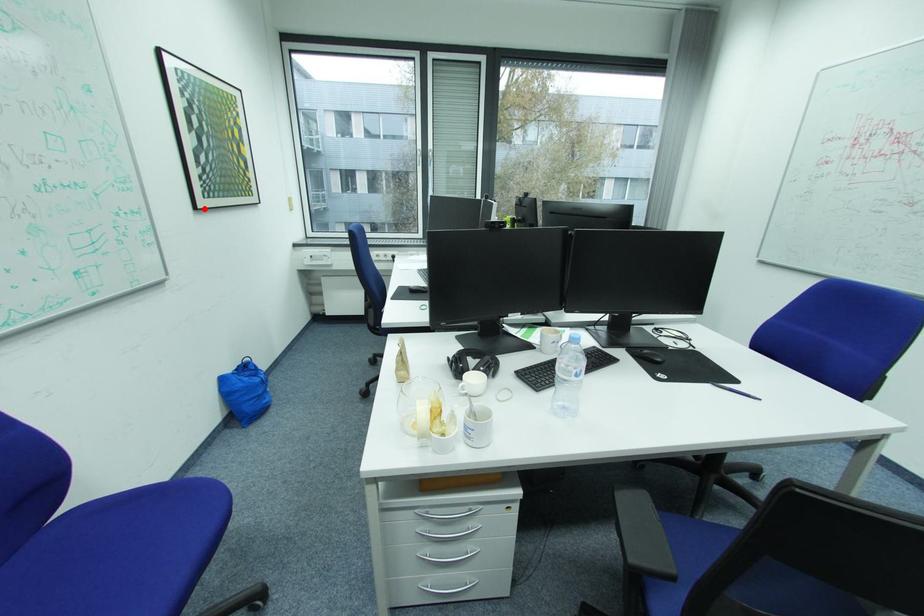
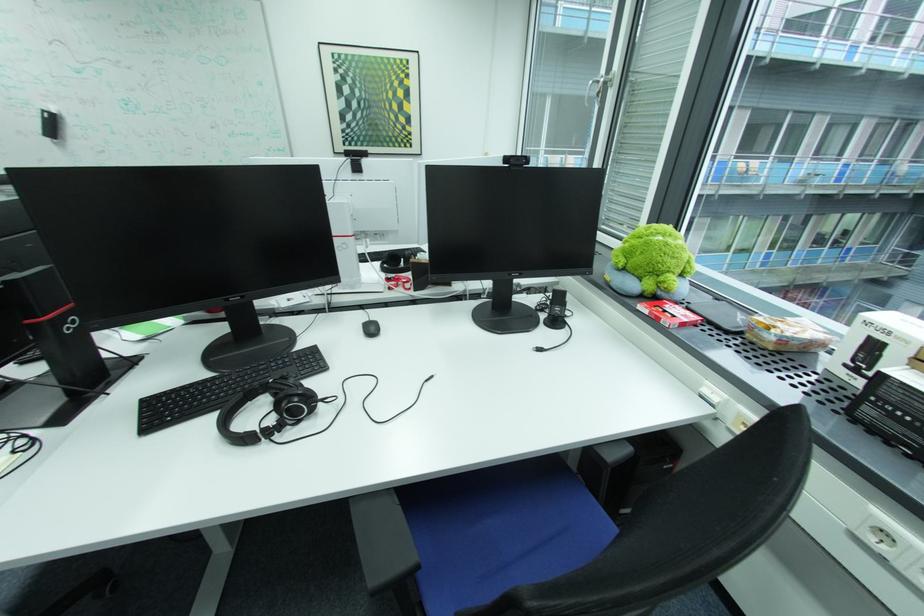
Where in the second image is the point corresponding to the highlighted location from the first image?

(344, 153)